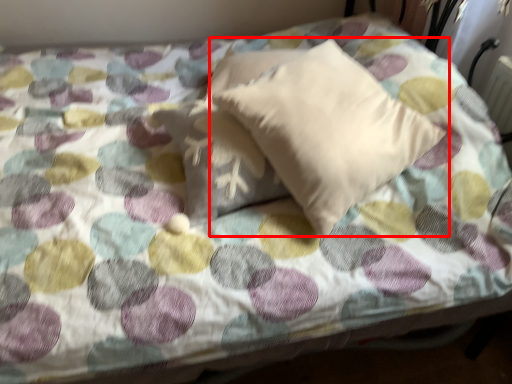
Question: In this image, where is pillow (annotated by the red box) located relative to pillow?

Choices:
 (A) right
 (B) left

Answer: (A)